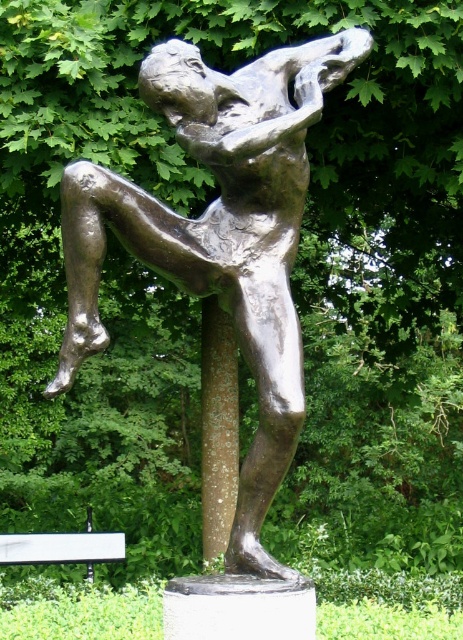
You are a photographer standing at the edge of the park. You want to take a photo of the bronze statue at center and the white plastic bench at lower left. Which object should you focus on first if you want both to be in sharp focus?

The bronze statue at center is closer to the viewer than the white plastic bench at lower left. To have both objects in sharp focus, you should focus on the bronze statue at center first, as it is closer, and the depth of field will extend to the bench behind it.

You are a visitor at the park and want to sit on the white plastic bench at lower left. Before sitting, you want to check if the bronze statue at center is wider than the bench. Can you confirm?

The bronze statue at center is wider than the white plastic bench at lower left, so yes, the statue is wider than the bench.